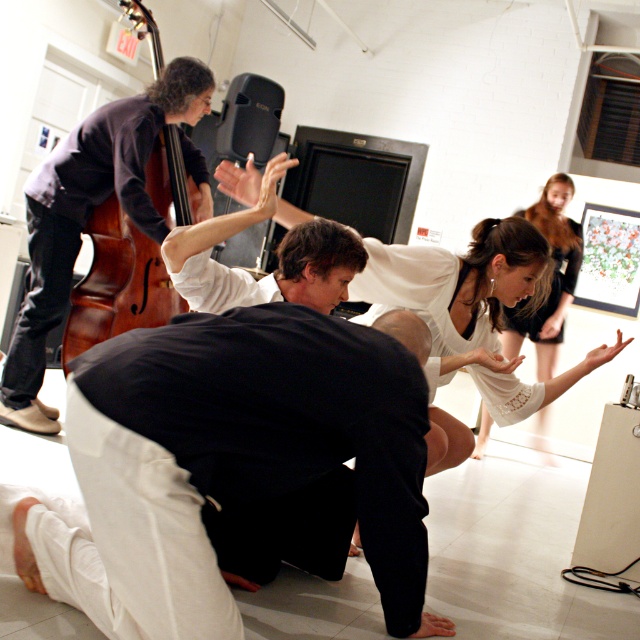
You are an event photographer at the art gallery. You need to capture a photo that includes both the white lace dress at center and the white lace dress at upper right. The minimum distance between them in your camera frame must be at least 6 feet. Can you achieve this with the current positioning?

The white lace dress at center is 6.47 feet from the white lace dress at upper right. Since 6.47 feet is greater than the required 6 feet minimum distance, yes, you can achieve this by positioning your camera to frame both dresses while maintaining the existing distance between them.

You are an event planner trying to arrange a photo shoot in the gallery. You need to position a large camera tripod that requires 2 meters of vertical clearance. Given the height of the brown wooden cello at left and the white lace dress at upper right, will the tripod fit under both without hitting anything?

The brown wooden cello at left is shorter than the white lace dress at upper right. Since the cello is shorter, the minimum vertical clearance needed would be based on the cello. However, without specific measurements, we cannot confirm if 2 meters is sufficient. Ensure the tripod is placed where it doesn

You are a photographer standing at the entrance of the gallery. You want to take a photo that includes both the black matte pants at lower center and the white lace dress at upper right. What is the minimum distance you need to move backward to ensure both subjects are in frame?

The black matte pants at lower center is 3.18 meters from the white lace dress at upper right. To include both in the frame, you need to move backward until you can cover a distance of at least 3.18 meters between them, which typically requires stepping back several paces depending on your camera lens.